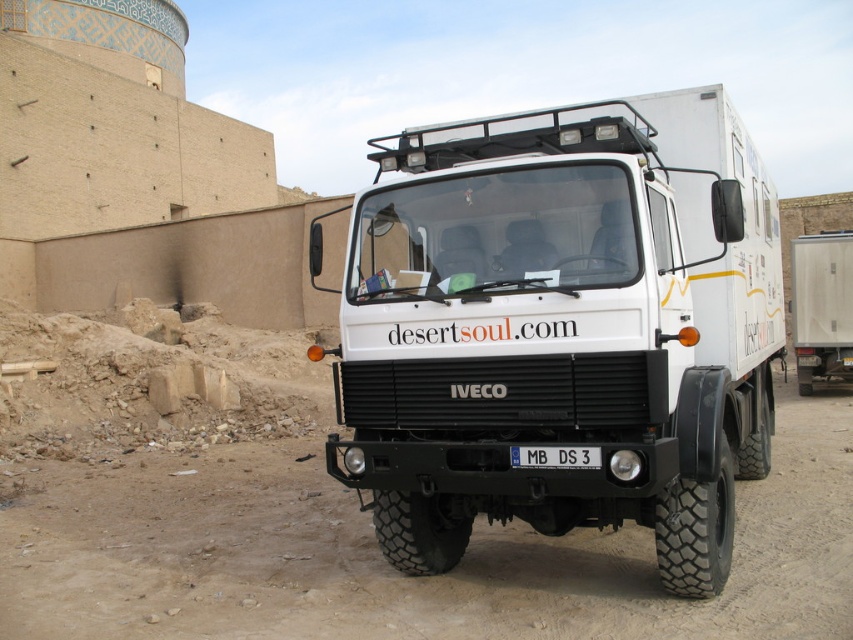
Is brown sandy dirt track at center bigger than white plastic license plate at center?

Yes.

In the scene shown: Which is more to the right, brown sandy dirt track at center or white plastic license plate at center?

From the viewer's perspective, white plastic license plate at center appears more on the right side.

Who is more forward, (117, 625) or (596, 465)?

Point (596, 465) is in front.

Identify the location of brown sandy dirt track at center. (389, 566).

Can you confirm if white matte truck at center is wider than brown sandy dirt track at center?

In fact, white matte truck at center might be narrower than brown sandy dirt track at center.

Identify the location of white matte truck at center. The image size is (853, 640). (561, 326).

The width and height of the screenshot is (853, 640). In order to click on white matte truck at center in this screenshot , I will do `click(561, 326)`.

How much distance is there between white matte trailer at right and white plastic license plate at center?

They are 12.63 meters apart.

Which is below, white matte trailer at right or white plastic license plate at center?

white plastic license plate at center

Find the location of a particular element. This screenshot has height=640, width=853. white matte trailer at right is located at coordinates (821, 307).